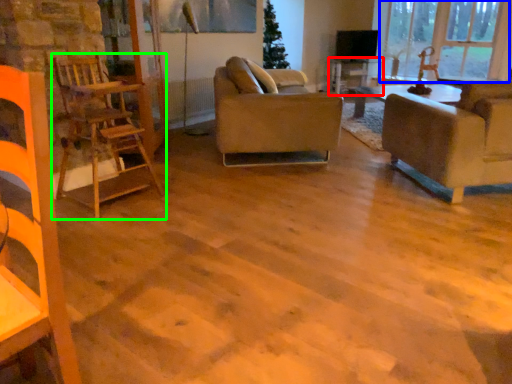
Question: Based on their relative distances, which object is farther from table (highlighted by a red box)? Choose from window (highlighted by a blue box) and chair (highlighted by a green box).

Choices:
 (A) window
 (B) chair

Answer: (B)